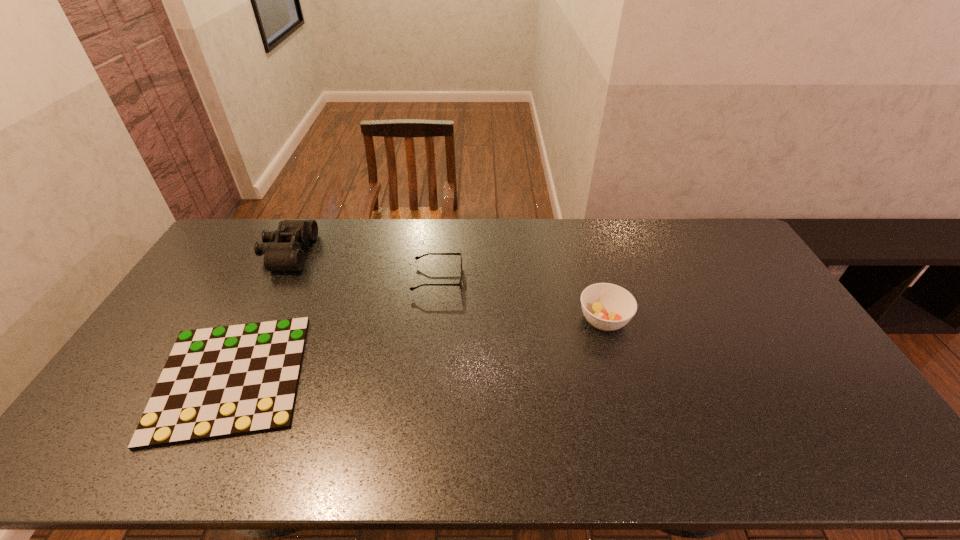
You are a GUI agent. You are given a task and a screenshot of the screen. Output one action in this format:
    pyautogui.click(x=<x>, y=<y>)
    Task: Click on the vacant space that satisfies the following two spatial constraints: 1. at the eyepieces of the binoculars; 2. on the back side of the soup bowl
    Image resolution: width=960 pixels, height=540 pixels.
    Given the screenshot: What is the action you would take?
    pyautogui.click(x=253, y=320)

Image resolution: width=960 pixels, height=540 pixels. What are the coordinates of `free location that satisfies the following two spatial constraints: 1. at the eyepieces of the third shortest object; 2. on the right side of the tallest object` in the screenshot? It's located at (253, 320).

You are a GUI agent. You are given a task and a screenshot of the screen. Output one action in this format:
    pyautogui.click(x=<x>, y=<y>)
    Task: Click on the vacant space that satisfies the following two spatial constraints: 1. at the eyepieces of the tallest object; 2. on the right side of the rightmost object
    
    Given the screenshot: What is the action you would take?
    pyautogui.click(x=253, y=320)

Image resolution: width=960 pixels, height=540 pixels. I want to click on free space that satisfies the following two spatial constraints: 1. at the eyepieces of the tallest object; 2. on the right side of the shortest object, so click(225, 377).

The height and width of the screenshot is (540, 960). Identify the location of free space that satisfies the following two spatial constraints: 1. at the eyepieces of the binoculars; 2. on the right side of the checkerboard. (225, 377).

At what (x,y) coordinates should I click in order to perform the action: click on free region that satisfies the following two spatial constraints: 1. on the back side of the third shortest object; 2. on the front lenses of the second object from right to left. Please return your answer as a coordinate pair (x, y). This screenshot has width=960, height=540. Looking at the image, I should click on (592, 279).

The height and width of the screenshot is (540, 960). Find the location of `vacant space that satisfies the following two spatial constraints: 1. at the eyepieces of the checkerboard; 2. on the right side of the tallest object`. vacant space that satisfies the following two spatial constraints: 1. at the eyepieces of the checkerboard; 2. on the right side of the tallest object is located at coordinates (225, 377).